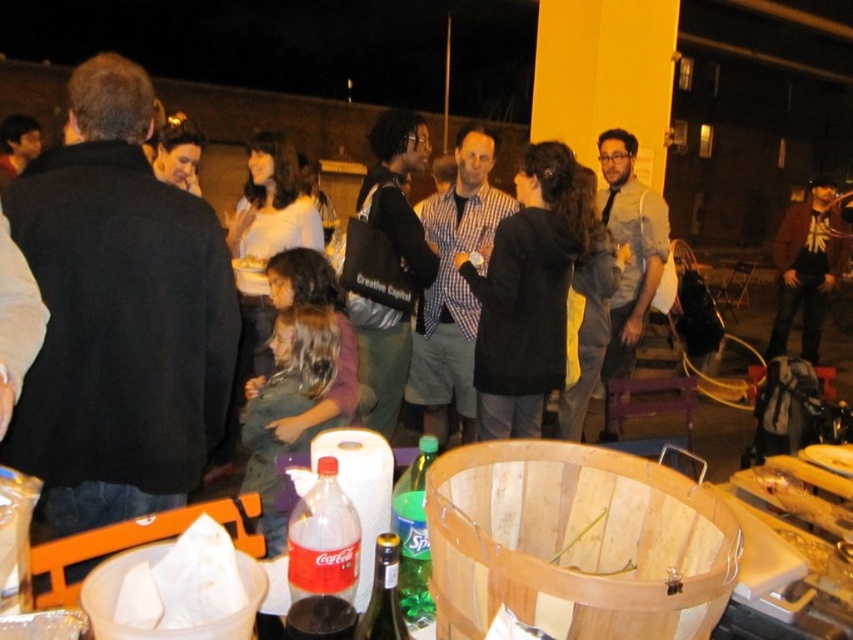
Question: Which point is closer to the camera taking this photo?

Choices:
 (A) (321, 620)
 (B) (810, 234)
 (C) (164, 371)

Answer: (A)

Question: Which object is positioned closest to the black matte coat at center?

Choices:
 (A) translucent plastic coca-cola bottle at lower center
 (B) yellow paper bag at center
 (C) translucent glass bottle at center
 (D) green glass bottle at center

Answer: (B)

Question: Where is black wool jacket at upper left located in relation to checkered fabric shirt at center in the image?

Choices:
 (A) right
 (B) left

Answer: (B)

Question: Which object is the farthest from the translucent glass bottle at center?

Choices:
 (A) checkered fabric shirt at center
 (B) black matte coat at center
 (C) yellow paper bag at center

Answer: (A)

Question: Can you confirm if checkered fabric shirt at center is thinner than translucent plastic coca-cola bottle at lower center?

Choices:
 (A) no
 (B) yes

Answer: (A)

Question: Is black matte coat at center in front of translucent plastic bottle at lower center?

Choices:
 (A) yes
 (B) no

Answer: (B)